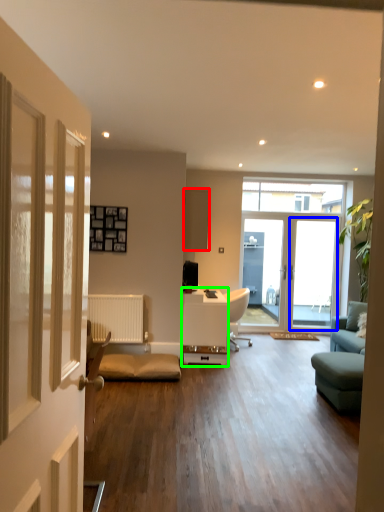
Question: Which is nearer to the cabinetry (highlighted by a red box)? screen door (highlighted by a blue box) or desk (highlighted by a green box).

Choices:
 (A) screen door
 (B) desk

Answer: (B)